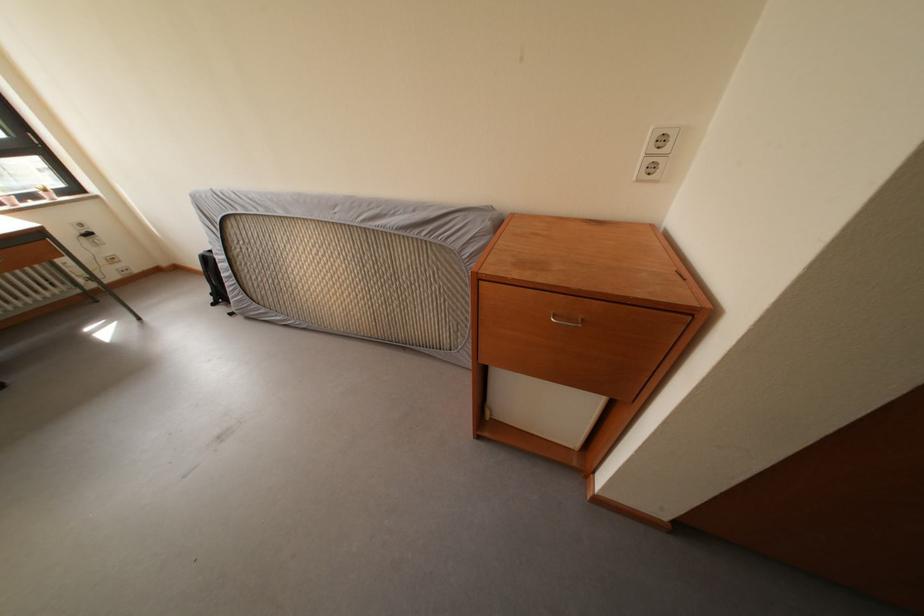
Where would you pull the metal drawer handle? Please return your answer as a coordinate pair (x, y).

(565, 321)